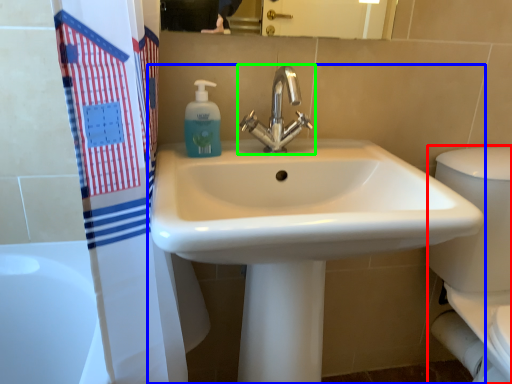
Question: Which is nearer to the porcelain (highlighted by a red box)? sink (highlighted by a blue box) or tap (highlighted by a green box).

Choices:
 (A) sink
 (B) tap

Answer: (A)